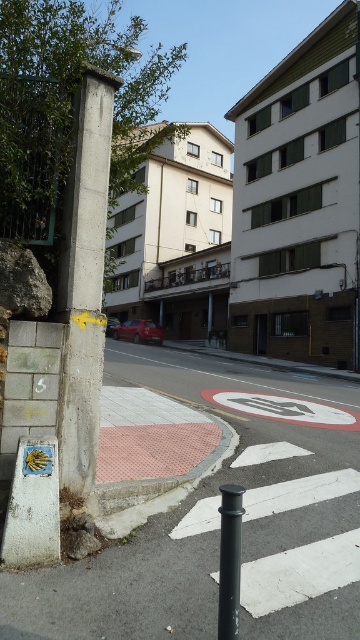
Question: Which point appears closest to the camera in this image?

Choices:
 (A) (230, 572)
 (B) (68, 332)

Answer: (A)

Question: Is concrete pole at center wider than black metal pole at lower center?

Choices:
 (A) yes
 (B) no

Answer: (A)

Question: Does concrete pole at center have a larger size compared to black metal pole at lower center?

Choices:
 (A) yes
 (B) no

Answer: (A)

Question: Does concrete pole at center appear on the left side of black metal pole at lower center?

Choices:
 (A) yes
 (B) no

Answer: (A)

Question: Which object appears closest to the camera in this image?

Choices:
 (A) black metal pole at lower center
 (B) concrete pole at center

Answer: (A)